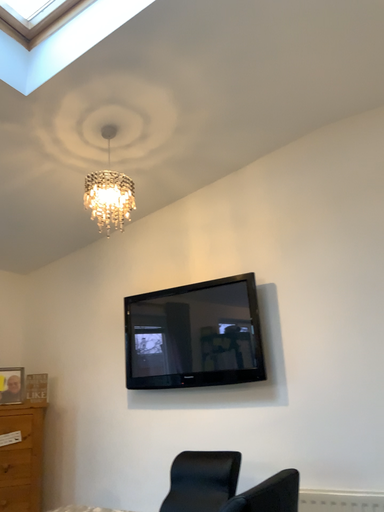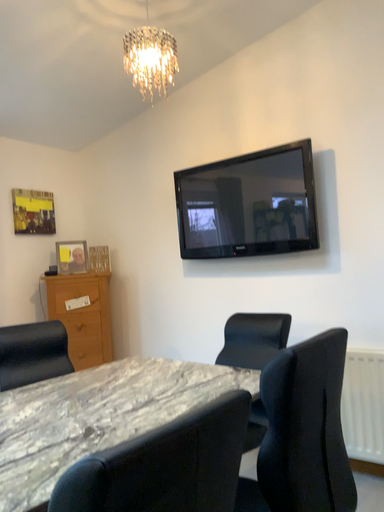
Question: Which way did the camera rotate in the video?

Choices:
 (A) rotated left
 (B) rotated right

Answer: (A)